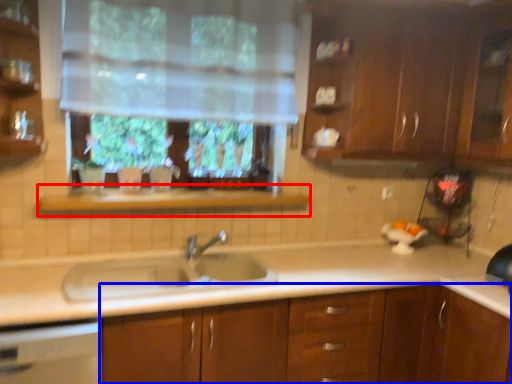
Question: Which object appears farthest to the camera in this image, window sill (highlighted by a red box) or cabinetry (highlighted by a blue box)?

Choices:
 (A) window sill
 (B) cabinetry

Answer: (A)